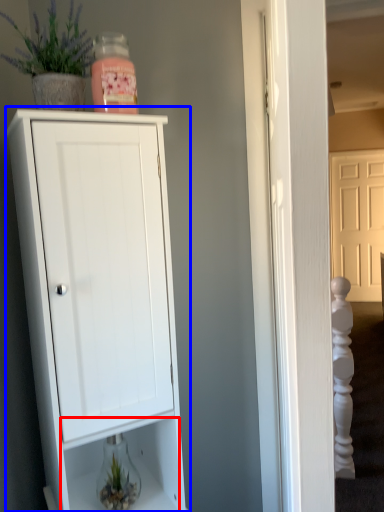
Question: Which of the following is the farthest to the observer, drawer (highlighted by a red box) or cupboard (highlighted by a blue box)?

Choices:
 (A) drawer
 (B) cupboard

Answer: (A)